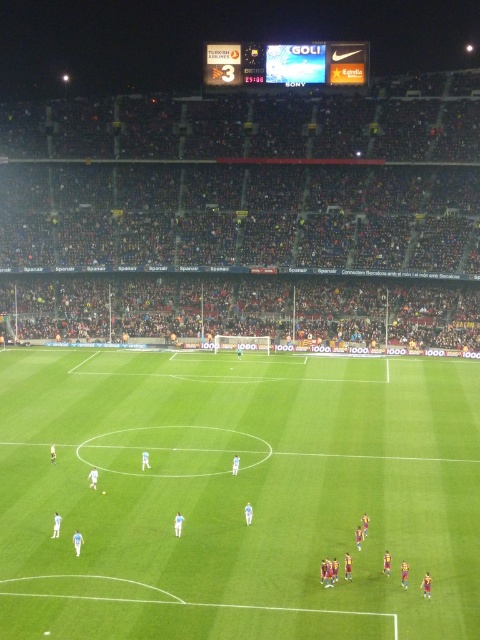
Based on the photo, you are a photographer positioned at the edge of the field. You want to capture a photo that includes both the green grass field at center and the maroon jersey players at center. Which object should you focus on first to ensure both are in sharp focus?

The green grass field at center is closer to the viewer than the maroon jersey players at center. To ensure both are in sharp focus, focus on the closer object, the green grass field at center, as it will keep both in focus range.

You are a spectator sitting in the stands at the soccer match. You notice two points on the field marked as point 1 at coordinates (170, 536) and point 2 at coordinates (233, 449). Which point appears closer to you?

Point 1 at coordinates (170, 536) is closer to the viewer than point 2 at coordinates (233, 449).

You are a photographer positioned at the edge of the field. You want to capture a photo that includes both the green grass field at center and the maroon jersey players at center. Based on their positions, which object should you adjust your camera to focus on first to ensure both are in the frame?

The maroon jersey players at center are to the left of the green grass field at center, so you should focus on the maroon jersey players at center first to ensure both are in the frame.